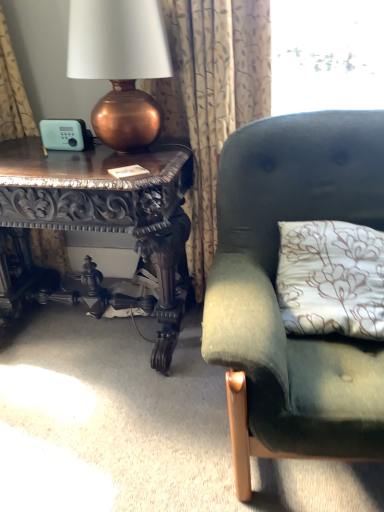
Question: In the image, is carved wood table at left positioned in front of or behind copper metallic lamp at left?

Choices:
 (A) front
 (B) behind

Answer: (B)

Question: Is point (49, 165) positioned closer to the camera than point (119, 130)?

Choices:
 (A) closer
 (B) farther

Answer: (A)

Question: Estimate the real-world distances between objects in this image. Which object is closer to the carved wood table at left?

Choices:
 (A) velvet green couch at right
 (B) copper metallic lamp at left
 (C) patterned fabric curtain at upper left

Answer: (C)

Question: Which object is the farthest from the carved wood table at left?

Choices:
 (A) copper metallic lamp at left
 (B) velvet green couch at right
 (C) patterned fabric curtain at upper left

Answer: (B)